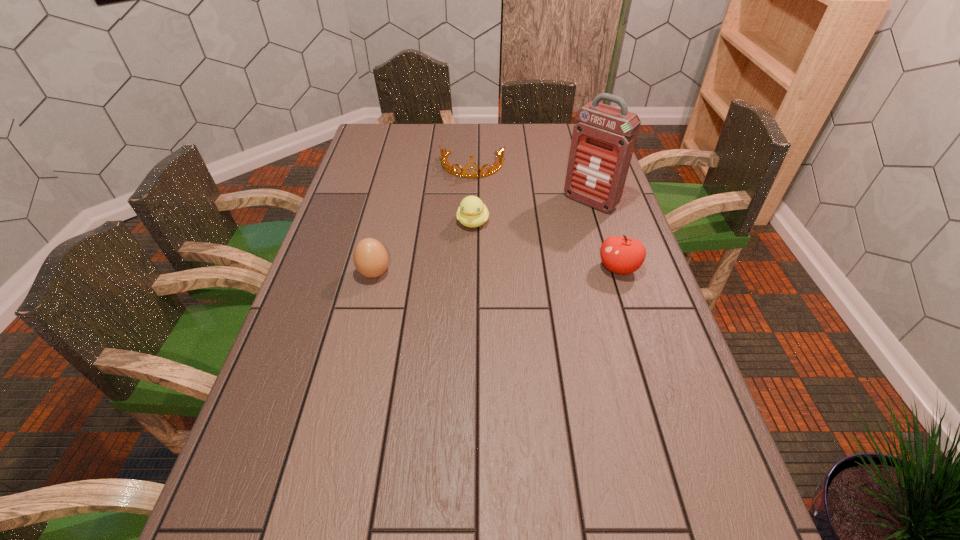
I want to click on free space between the duckling and the boiled egg, so click(423, 248).

Find the location of a particular element. free space between the apple and the boiled egg is located at coordinates (496, 271).

The image size is (960, 540). What are the coordinates of `free point between the apple and the boiled egg` in the screenshot? It's located at (496, 271).

This screenshot has width=960, height=540. I want to click on vacant area that lies between the tiara and the duckling, so click(x=472, y=194).

At what (x,y) coordinates should I click in order to perform the action: click on empty space between the farthest object and the tallest object. Please return your answer as a coordinate pair (x, y). This screenshot has height=540, width=960. Looking at the image, I should click on (532, 184).

Locate an element on the screen. free spot between the first-aid kit and the apple is located at coordinates (604, 235).

The image size is (960, 540). I want to click on object that stands as the second closest to the boiled egg, so click(447, 167).

This screenshot has width=960, height=540. Find the location of `the closest object relative to the first-aid kit`. the closest object relative to the first-aid kit is located at coordinates (621, 255).

Where is `vacant position in the image that satisfies the following two spatial constraints: 1. on the front side of the duckling; 2. on the left side of the apple`? The width and height of the screenshot is (960, 540). vacant position in the image that satisfies the following two spatial constraints: 1. on the front side of the duckling; 2. on the left side of the apple is located at coordinates (472, 268).